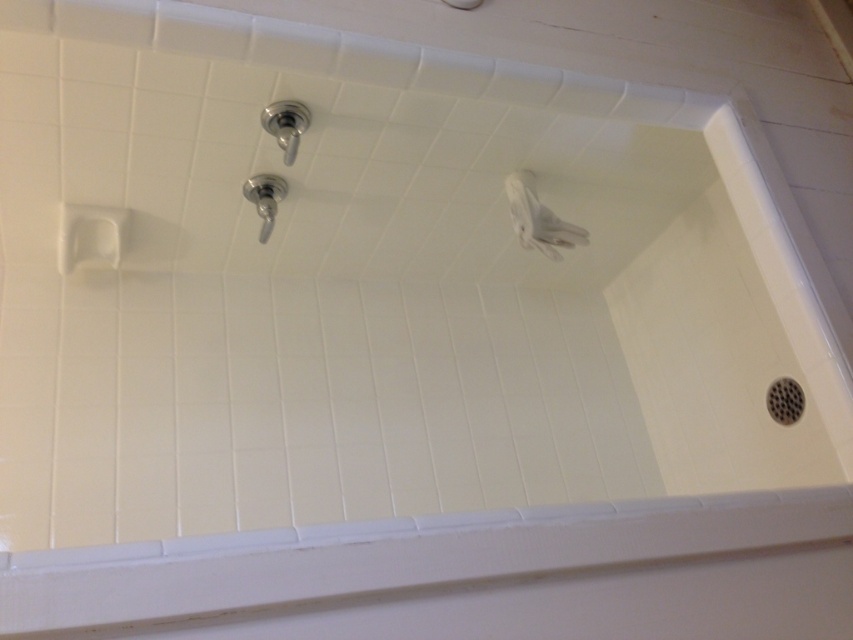
You are standing in the shower and want to adjust the water temperature. Which object should you reach for first, the satin nickel showerhead at upper center or the satin nickel faucet at upper center?

The satin nickel faucet at upper center is behind the satin nickel showerhead at upper center, so you should reach for the satin nickel faucet at upper center first.

You are designing a shower layout and need to ensure proper spacing between the satin nickel showerhead at upper center and the satin nickel faucet at upper center. Based on the image, which of these two objects requires more space for installation?

The satin nickel faucet at upper center requires more space for installation since it occupies more space than the satin nickel showerhead at upper center.

You are installing a new showerhead and faucet in the shower area. The existing showerhead and faucet are both at upper center. If the satin nickel showerhead at upper center is narrower than the satin nickel faucet at upper center, which one should you replace first to ensure proper installation alignment?

The satin nickel showerhead at upper center is narrower than the satin nickel faucet at upper center, so you should replace the faucet first to ensure proper alignment since it is wider and might require more space for installation.